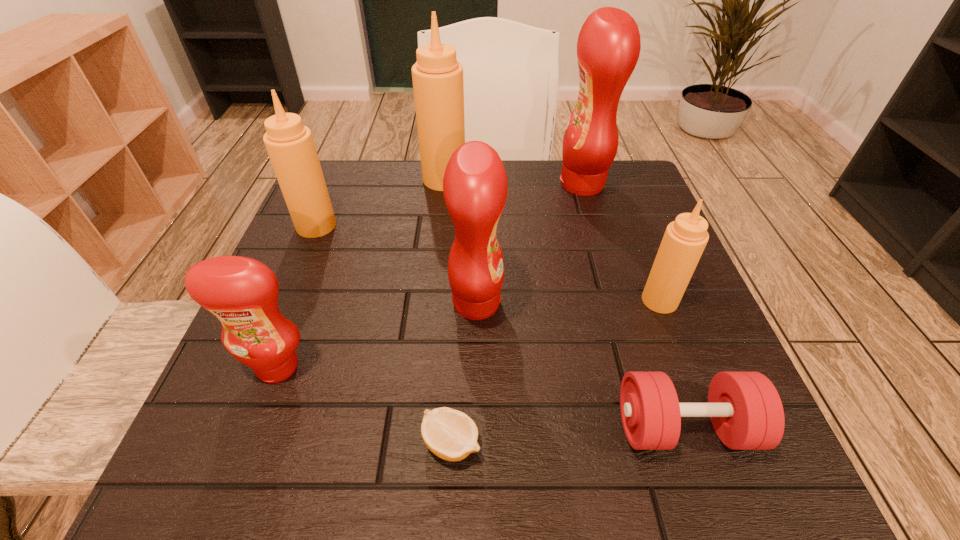
Locate an element on the screen. The height and width of the screenshot is (540, 960). empty space that is in between the dumbbell and the third farthest condiment is located at coordinates (500, 327).

You are a GUI agent. You are given a task and a screenshot of the screen. Output one action in this format:
    pyautogui.click(x=<x>, y=<y>)
    Task: Click on the empty space that is in between the rightmost tan condiment and the dumbbell
    This screenshot has height=540, width=960.
    Given the screenshot: What is the action you would take?
    pyautogui.click(x=672, y=364)

The height and width of the screenshot is (540, 960). Identify the location of free space that is in between the leftmost red condiment and the lemon. (365, 405).

This screenshot has width=960, height=540. Identify the location of vacant area between the nearest red condiment and the sixth nearest object. click(x=297, y=296).

What are the coordinates of `vacant area that lies between the nearest tan condiment and the second shortest object` in the screenshot? It's located at (672, 364).

Where is `vacant area that lies between the biggest red condiment and the shortest object`? This screenshot has width=960, height=540. vacant area that lies between the biggest red condiment and the shortest object is located at coordinates (516, 314).

Image resolution: width=960 pixels, height=540 pixels. In order to click on object that can be found as the sixth closest to the smallest tan condiment in this screenshot , I will do `click(241, 292)`.

Identify the location of object that stands as the closest to the biggest tan condiment. The width and height of the screenshot is (960, 540). (290, 145).

Where is `the fifth closest condiment to the second nearest red condiment`? the fifth closest condiment to the second nearest red condiment is located at coordinates (290, 145).

Locate an element on the screen. condiment that is the fourth closest to the second nearest red condiment is located at coordinates (437, 76).